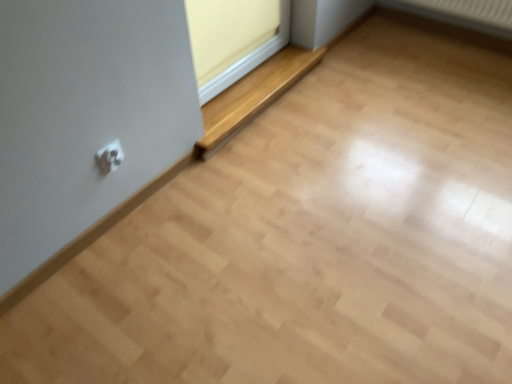
Question: Is matte yellow window frame at upper center positioned beyond the bounds of white plastic electric outlet at lower left?

Choices:
 (A) no
 (B) yes

Answer: (B)

Question: Does matte yellow window frame at upper center lie in front of white plastic electric outlet at lower left?

Choices:
 (A) yes
 (B) no

Answer: (B)

Question: Is matte yellow window frame at upper center further to camera compared to white plastic electric outlet at lower left?

Choices:
 (A) yes
 (B) no

Answer: (A)

Question: Does matte yellow window frame at upper center appear on the left side of white plastic electric outlet at lower left?

Choices:
 (A) no
 (B) yes

Answer: (A)

Question: Considering the relative sizes of matte yellow window frame at upper center and white plastic electric outlet at lower left in the image provided, is matte yellow window frame at upper center wider than white plastic electric outlet at lower left?

Choices:
 (A) no
 (B) yes

Answer: (B)

Question: Would you say white plastic electric outlet at lower left is inside or outside wooden at lower center?

Choices:
 (A) inside
 (B) outside

Answer: (B)

Question: Considering the positions of white plastic electric outlet at lower left and wooden at lower center in the image, is white plastic electric outlet at lower left wider or thinner than wooden at lower center?

Choices:
 (A) thin
 (B) wide

Answer: (A)

Question: From a real-world perspective, relative to wooden at lower center, is white plastic electric outlet at lower left vertically above or below?

Choices:
 (A) above
 (B) below

Answer: (A)

Question: From the image's perspective, relative to wooden at lower center, is white plastic electric outlet at lower left above or below?

Choices:
 (A) below
 (B) above

Answer: (A)

Question: Considering the positions of white plastic electric outlet at lower left and matte yellow window frame at upper center in the image, is white plastic electric outlet at lower left wider or thinner than matte yellow window frame at upper center?

Choices:
 (A) thin
 (B) wide

Answer: (A)

Question: From a real-world perspective, is white plastic electric outlet at lower left positioned above or below matte yellow window frame at upper center?

Choices:
 (A) above
 (B) below

Answer: (B)

Question: Is white plastic electric outlet at lower left taller or shorter than matte yellow window frame at upper center?

Choices:
 (A) short
 (B) tall

Answer: (A)

Question: Would you say white plastic electric outlet at lower left is inside or outside matte yellow window frame at upper center?

Choices:
 (A) inside
 (B) outside

Answer: (B)

Question: Considering their positions, is wooden at lower center located in front of or behind matte yellow window frame at upper center?

Choices:
 (A) behind
 (B) front

Answer: (A)

Question: In terms of size, does wooden at lower center appear bigger or smaller than matte yellow window frame at upper center?

Choices:
 (A) small
 (B) big

Answer: (B)